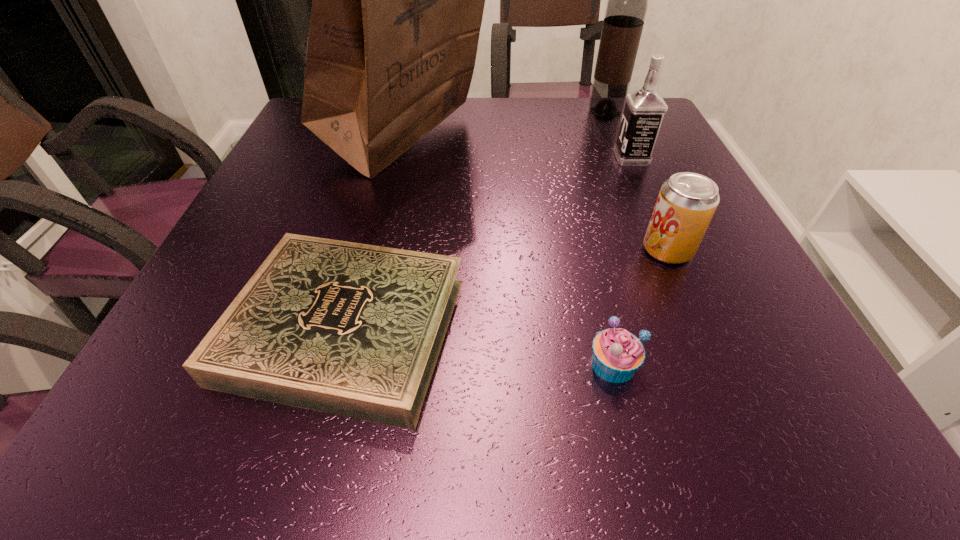
In order to click on the tallest object in this screenshot , I will do `click(397, 0)`.

Locate an element on the screen. This screenshot has width=960, height=540. wine bottle is located at coordinates (627, 4).

The height and width of the screenshot is (540, 960). In order to click on vodka in this screenshot , I will do `click(644, 110)`.

Where is `pop (soda)`? pop (soda) is located at coordinates (687, 201).

In order to click on the third object from left to right in this screenshot , I will do `click(617, 354)`.

At what (x,y) coordinates should I click in order to perform the action: click on the second shortest object. Please return your answer as a coordinate pair (x, y). Image resolution: width=960 pixels, height=540 pixels. Looking at the image, I should click on (617, 354).

Locate an element on the screen. This screenshot has height=540, width=960. hardback book is located at coordinates (351, 329).

Identify the location of blank space located 0.350m on the right of the grocery bag. This screenshot has width=960, height=540. (636, 144).

Find the location of a particular element. This screenshot has width=960, height=540. vacant region located on the left of the second tallest object is located at coordinates (444, 111).

This screenshot has height=540, width=960. I want to click on vacant position located on the front label of the vodka, so click(583, 158).